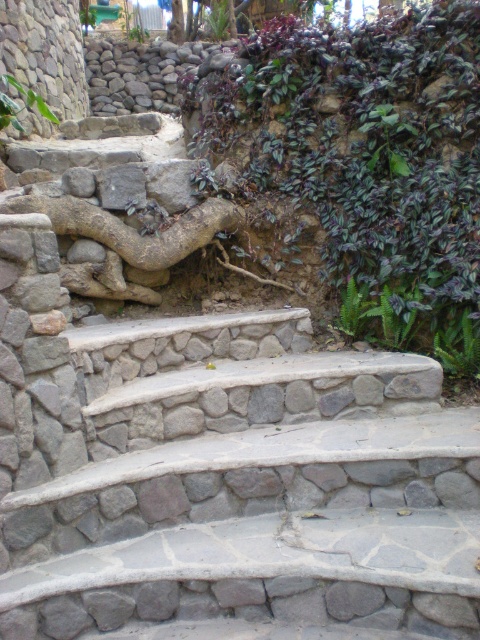
Looking at this image, is natural stone stairs at center to the left of brown rough tree root at center from the viewer's perspective?

No, natural stone stairs at center is not to the left of brown rough tree root at center.

Is natural stone stairs at center above brown rough tree root at center?

Incorrect, natural stone stairs at center is not positioned above brown rough tree root at center.

Is point (124, 448) more distant than point (96, 214)?

That is False.

Where is `natural stone stairs at center`? This screenshot has width=480, height=640. natural stone stairs at center is located at coordinates (250, 488).

Who is positioned more to the left, brown rough tree root at center or rough stone wall at upper left?

From the viewer's perspective, rough stone wall at upper left appears more on the left side.

Does brown rough tree root at center come behind rough stone wall at upper left?

No, brown rough tree root at center is in front of rough stone wall at upper left.

Does point (167, 234) come farther from viewer compared to point (117, 81)?

No, (167, 234) is closer to viewer.

This screenshot has width=480, height=640. What are the coordinates of `brown rough tree root at center` in the screenshot? It's located at (132, 227).

Is purple leafy plant at upper right wider than green leafy plant at lower right?

Yes, purple leafy plant at upper right is wider than green leafy plant at lower right.

Between purple leafy plant at upper right and green leafy plant at lower right, which one has more height?

purple leafy plant at upper right is taller.

Is point (243, 68) behind point (468, 356)?

Yes, point (243, 68) is behind point (468, 356).

What are the coordinates of `purple leafy plant at upper right` in the screenshot? It's located at (363, 156).